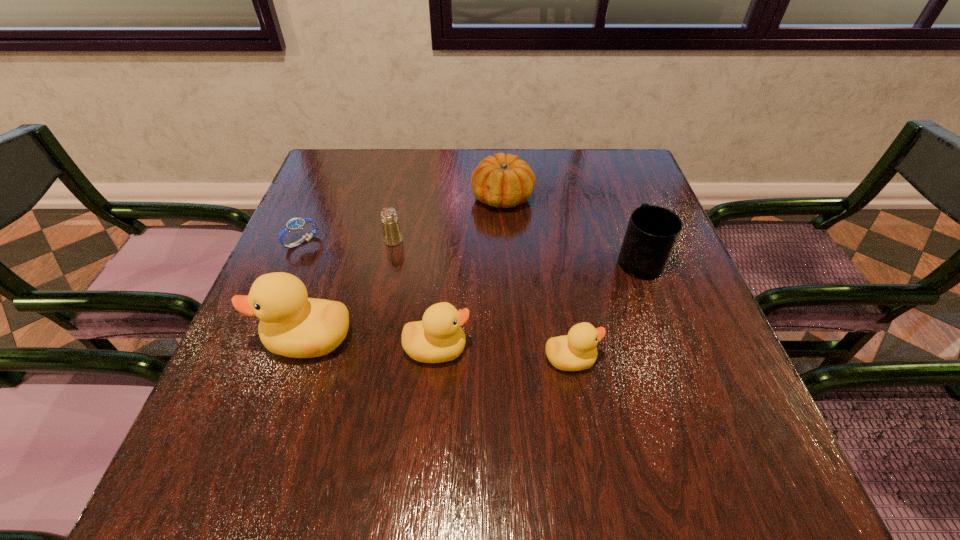
Locate an element on the screen. blank space at the far edge of the desktop is located at coordinates (567, 180).

Find the location of `free space at the near edge of the desktop`. free space at the near edge of the desktop is located at coordinates (596, 401).

You are a GUI agent. You are given a task and a screenshot of the screen. Output one action in this format:
    pyautogui.click(x=<x>, y=<y>)
    Task: Click on the vacant area at the left edge of the desktop
    Image resolution: width=960 pixels, height=540 pixels.
    Given the screenshot: What is the action you would take?
    pyautogui.click(x=321, y=295)

In the image, there is a desktop. Where is `free space at the right edge`? free space at the right edge is located at coordinates (662, 316).

I want to click on vacant position at the far left corner of the desktop, so click(333, 192).

This screenshot has height=540, width=960. Find the location of `vacant space at the near left corner of the desktop`. vacant space at the near left corner of the desktop is located at coordinates (254, 410).

In the image, there is a desktop. At what (x,y) coordinates should I click in order to perform the action: click on vacant area at the far right corner. Please return your answer as a coordinate pair (x, y). The image size is (960, 540). Looking at the image, I should click on click(636, 172).

Where is `vacant area that lies between the farthest object and the mug`? The height and width of the screenshot is (540, 960). vacant area that lies between the farthest object and the mug is located at coordinates (x=571, y=228).

Where is `free space between the third object from left to right and the leftmost duckling`? The width and height of the screenshot is (960, 540). free space between the third object from left to right and the leftmost duckling is located at coordinates (350, 289).

The image size is (960, 540). In order to click on unoccupied position between the tallest object and the gourd in this screenshot , I will do `click(405, 268)`.